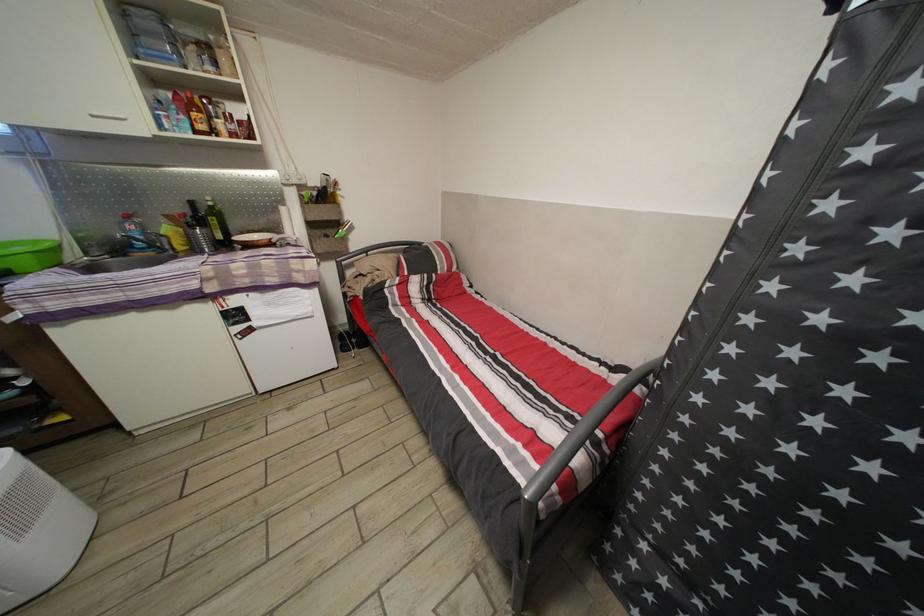
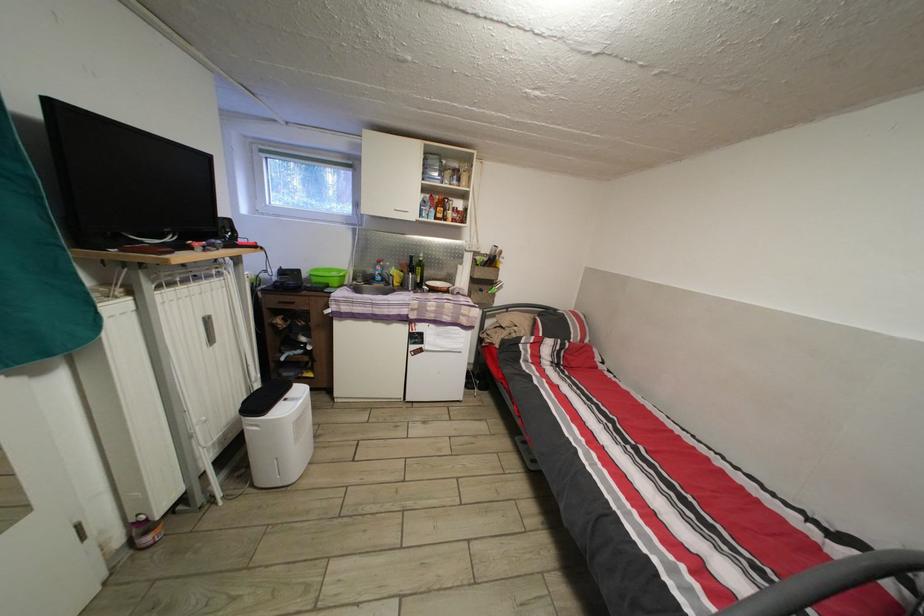
Find the pixel in the second image that matches point (149, 233) in the first image.

(390, 274)